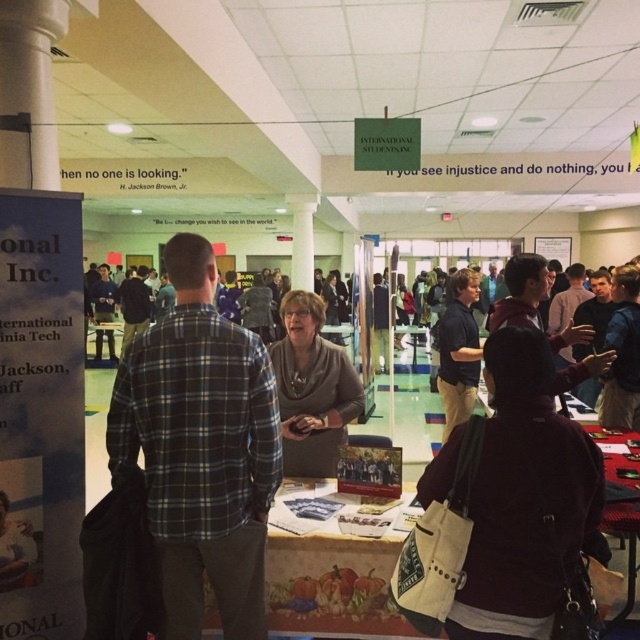
You are at an event space and need to locate the plaid flannel shirt at center. According to the coordinates provided, where exactly is it positioned?

The plaid flannel shirt at center is positioned at coordinates point (200,449).

You are standing at the booth and want to move from point A to point B. Point A is at coordinates point (x=193, y=388) and point B is at point (x=525, y=364). Can you walk directly from point A to point B without any obstacles?

Point (x=193, y=388) is behind point (x=525, y=364), so you cannot walk directly from point A to point B without obstacles.

You are an event planner trying to arrange a photo shoot at the booth. The photographer wants to ensure that both the plaid flannel shirt at center and the maroon fabric jacket at center are visible in the frame. Given their heights, which item should be placed closer to the camera to ensure both are fully visible?

The plaid flannel shirt at center is much taller than the maroon fabric jacket at center. To ensure both are fully visible in the photo, the maroon fabric jacket at center should be placed closer to the camera so that its shorter height doesn